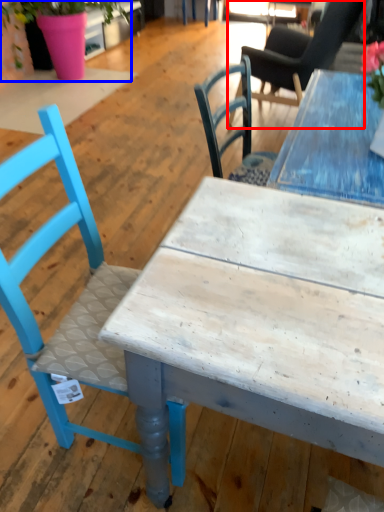
Question: Which object is closer to the camera taking this photo, chair (highlighted by a red box) or houseplant (highlighted by a blue box)?

Choices:
 (A) chair
 (B) houseplant

Answer: (A)